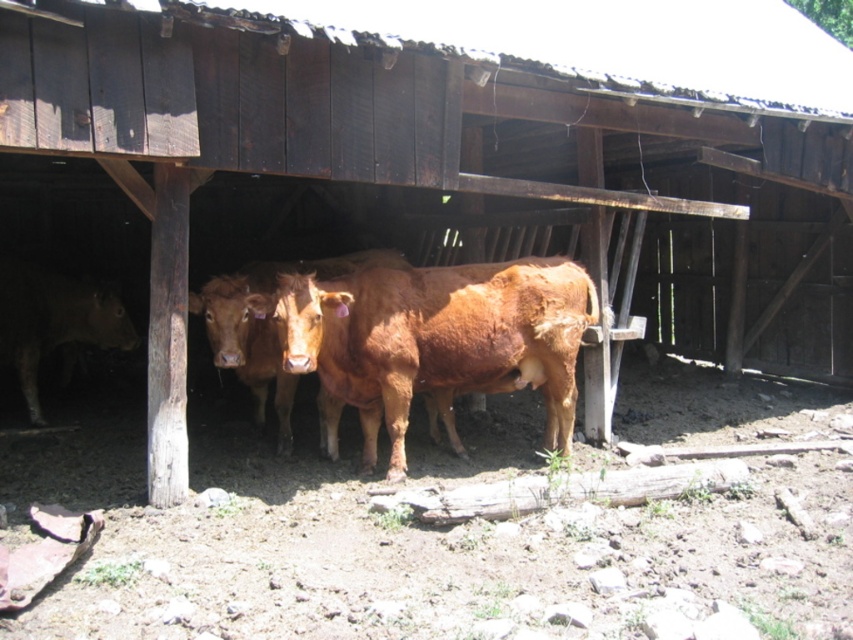
Question: Among these objects, which one is farthest from the camera?

Choices:
 (A) brown smooth cow at left
 (B) brown rough cow at center
 (C) brown smooth cow at center

Answer: (A)

Question: Can you confirm if brown rough cow at center is positioned to the right of brown smooth cow at left?

Choices:
 (A) no
 (B) yes

Answer: (B)

Question: Based on their relative distances, which object is nearer to the brown rough cow at center?

Choices:
 (A) brown smooth cow at center
 (B) brown smooth cow at left

Answer: (A)

Question: Can you confirm if brown smooth cow at center is thinner than brown smooth cow at left?

Choices:
 (A) no
 (B) yes

Answer: (A)

Question: Is brown rough cow at center thinner than brown smooth cow at center?

Choices:
 (A) yes
 (B) no

Answer: (B)

Question: Which point is closer to the camera taking this photo?

Choices:
 (A) (68, 276)
 (B) (287, 321)
 (C) (218, 365)

Answer: (B)